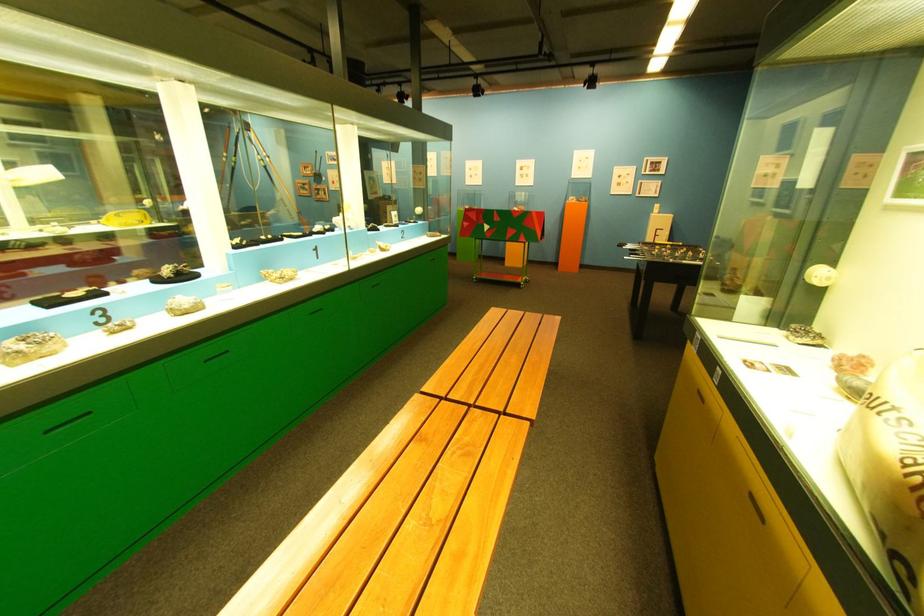
You are a GUI agent. You are given a task and a screenshot of the screen. Output one action in this format:
    pyautogui.click(x=<x>, y=<y>)
    Task: Click on the bench sitting surface
    The height and width of the screenshot is (616, 924).
    Given the screenshot: What is the action you would take?
    pyautogui.click(x=517, y=374)